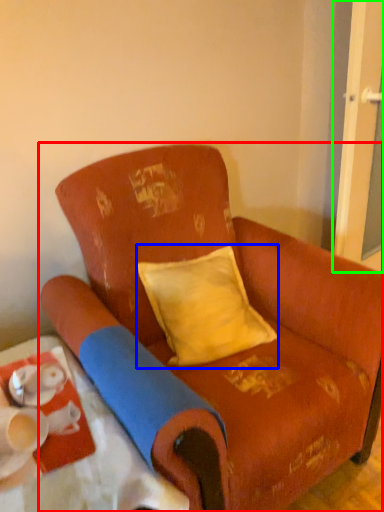
Question: Which object is the closest to the chair (highlighted by a red box)? Choose among these: pillow (highlighted by a blue box) or screen door (highlighted by a green box).

Choices:
 (A) pillow
 (B) screen door

Answer: (A)